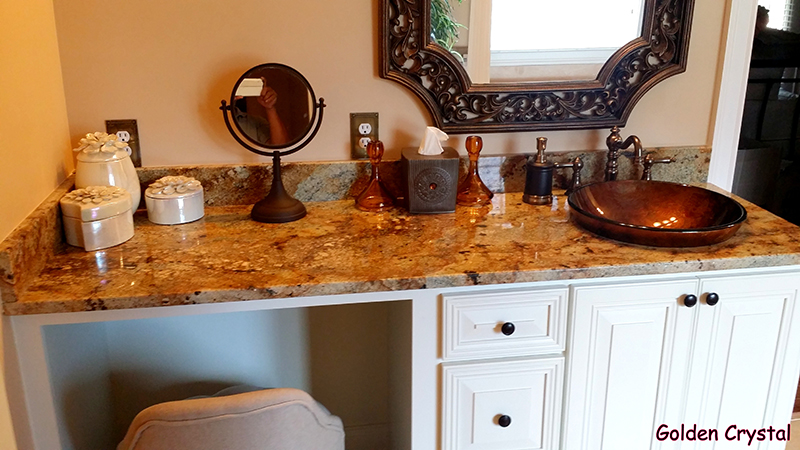
Where is `electrical outlet`? electrical outlet is located at coordinates (368, 135).